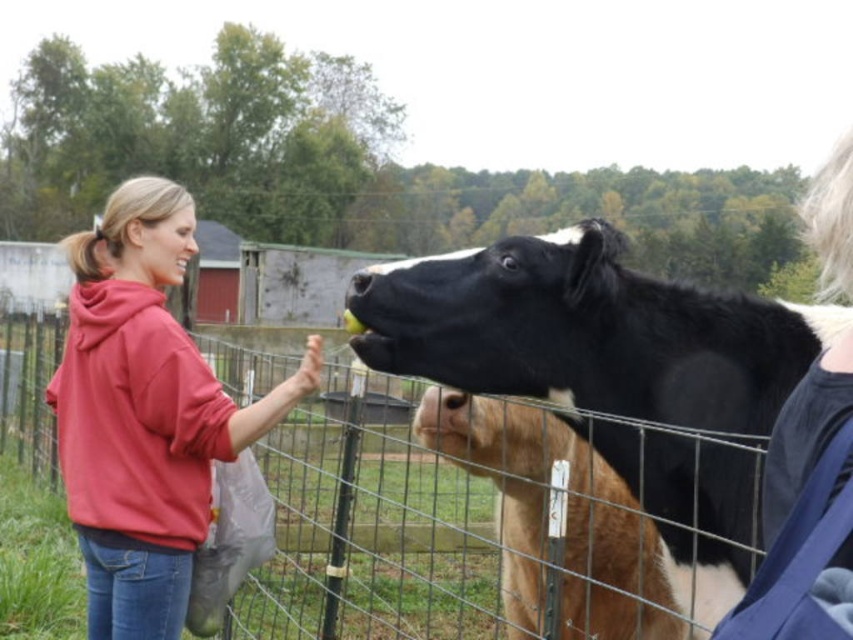
Which is more to the left, black glossy cow at upper center or matte red hoodie at center left?

matte red hoodie at center left is more to the left.

Can you confirm if black glossy cow at upper center is positioned above matte red hoodie at center left?

Correct, black glossy cow at upper center is located above matte red hoodie at center left.

Does point (834, 320) come in front of point (165, 346)?

Yes.

Identify the location of black glossy cow at upper center. The image size is (853, 640). (613, 376).

How far apart are black glossy cow at upper center and brown furry calf at center?

A distance of 10.15 inches exists between black glossy cow at upper center and brown furry calf at center.

Between black glossy cow at upper center and brown furry calf at center, which one has less height?

brown furry calf at center is shorter.

Locate an element on the screen. This screenshot has height=640, width=853. black glossy cow at upper center is located at coordinates (613, 376).

Image resolution: width=853 pixels, height=640 pixels. I want to click on black glossy cow at upper center, so click(613, 376).

Is matte red hoodie at center left to the left of brown furry calf at center from the viewer's perspective?

Correct, you'll find matte red hoodie at center left to the left of brown furry calf at center.

Can you confirm if matte red hoodie at center left is positioned below brown furry calf at center?

Incorrect, matte red hoodie at center left is not positioned below brown furry calf at center.

Is point (79, 275) behind point (598, 586)?

No, it is in front of (598, 586).

You are a GUI agent. You are given a task and a screenshot of the screen. Output one action in this format:
    pyautogui.click(x=<x>, y=<y>)
    Task: Click on the matte red hoodie at center left
    
    Given the screenshot: What is the action you would take?
    pyautogui.click(x=144, y=413)